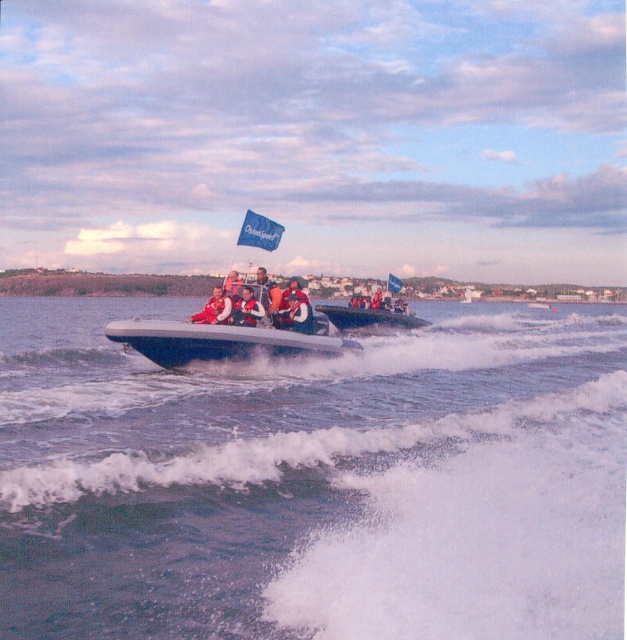
From the picture: Is blue fabric flag at center below red life vest at center?

No, blue fabric flag at center is not below red life vest at center.

This screenshot has height=640, width=627. Describe the element at coordinates (260, 230) in the screenshot. I see `blue fabric flag at center` at that location.

Where is `blue fabric flag at center`? Image resolution: width=627 pixels, height=640 pixels. blue fabric flag at center is located at coordinates (260, 230).

Does shiny blue boat at center appear under blue fabric flag at upper center?

Indeed, shiny blue boat at center is positioned under blue fabric flag at upper center.

You are a GUI agent. You are given a task and a screenshot of the screen. Output one action in this format:
    pyautogui.click(x=<x>, y=<y>)
    Task: Click on the shiny blue boat at center
    This screenshot has width=627, height=640.
    Given the screenshot: What is the action you would take?
    pyautogui.click(x=371, y=314)

Where is `shiny blue boat at center`? The width and height of the screenshot is (627, 640). shiny blue boat at center is located at coordinates (371, 314).

Can you confirm if blue fabric flag at center is shorter than orange life jacket at center?

Incorrect, blue fabric flag at center's height does not fall short of orange life jacket at center's.

Is point (275, 236) positioned in front of point (214, 296)?

No.

In order to click on blue fabric flag at center in this screenshot , I will do `click(260, 230)`.